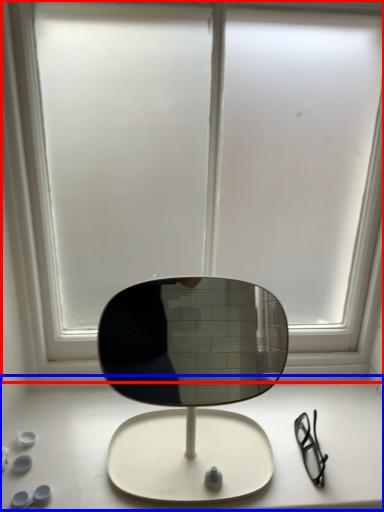
Question: Among these objects, which one is farthest to the camera, window (highlighted by a red box) or table top (highlighted by a blue box)?

Choices:
 (A) window
 (B) table top

Answer: (B)